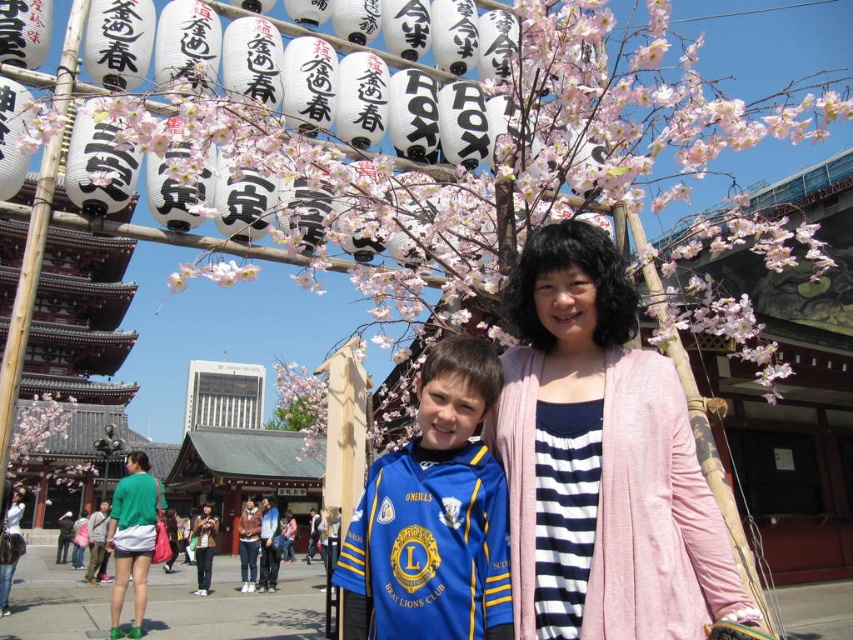
Does pink fabric at center appear on the right side of blue jersey at center?

Indeed, pink fabric at center is positioned on the right side of blue jersey at center.

Can you confirm if pink fabric at center is positioned above blue jersey at center?

Correct, pink fabric at center is located above blue jersey at center.

Between point (596, 340) and point (437, 616), which one is positioned in front?

Point (437, 616) is more forward.

This screenshot has width=853, height=640. In order to click on pink fabric at center in this screenshot , I will do `click(601, 460)`.

Is pink fabric at center closer to camera compared to green jersey at center?

Yes, it is.

Is pink fabric at center taller than green jersey at center?

No.

Does point (546, 262) come closer to viewer compared to point (134, 524)?

Yes, it is in front of point (134, 524).

At what (x,y) coordinates should I click in order to perform the action: click on pink fabric at center. Please return your answer as a coordinate pair (x, y). Image resolution: width=853 pixels, height=640 pixels. Looking at the image, I should click on (601, 460).

Which is more to the left, blue jersey at center or green jersey at center?

green jersey at center

Is blue jersey at center to the right of green jersey at center from the viewer's perspective?

Correct, you'll find blue jersey at center to the right of green jersey at center.

The height and width of the screenshot is (640, 853). Find the location of `blue jersey at center`. blue jersey at center is located at coordinates [433, 516].